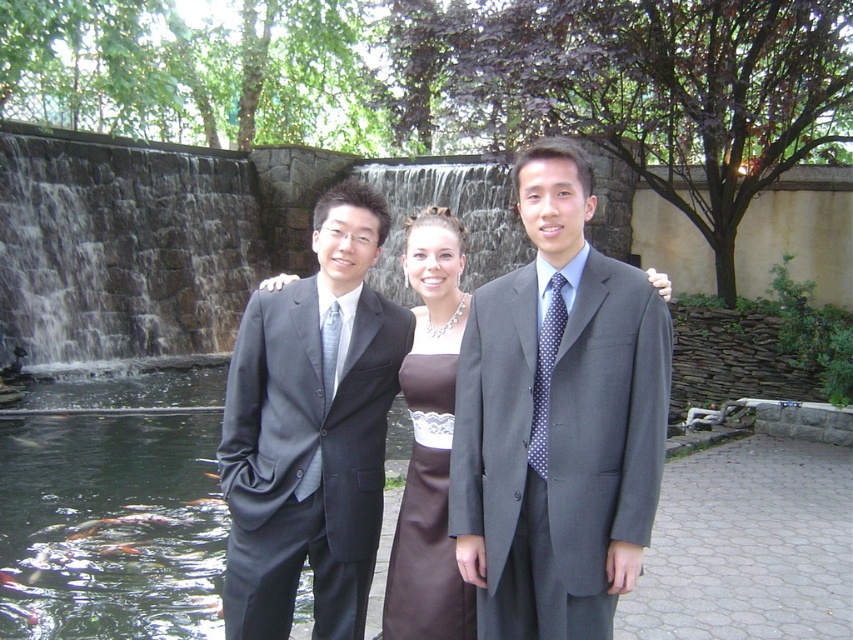
Question: Which of these objects is positioned closest to the matte black suit at center?

Choices:
 (A) brown satin dress at center
 (B) matte gray suit at center

Answer: (A)

Question: Does matte gray suit at center come in front of matte black suit at center?

Choices:
 (A) yes
 (B) no

Answer: (A)

Question: Does brown satin dress at center appear on the left side of shiny orange fish at center?

Choices:
 (A) no
 (B) yes

Answer: (A)

Question: Does matte gray suit at center have a smaller size compared to shiny orange fish at center?

Choices:
 (A) yes
 (B) no

Answer: (B)

Question: Which point is farther to the camera?

Choices:
 (A) (413, 244)
 (B) (543, 500)
 (C) (120, 544)

Answer: (C)

Question: Which of the following is the farthest from the observer?

Choices:
 (A) brown satin dress at center
 (B) matte black suit at center
 (C) shiny orange fish at center
 (D) matte gray suit at center

Answer: (C)